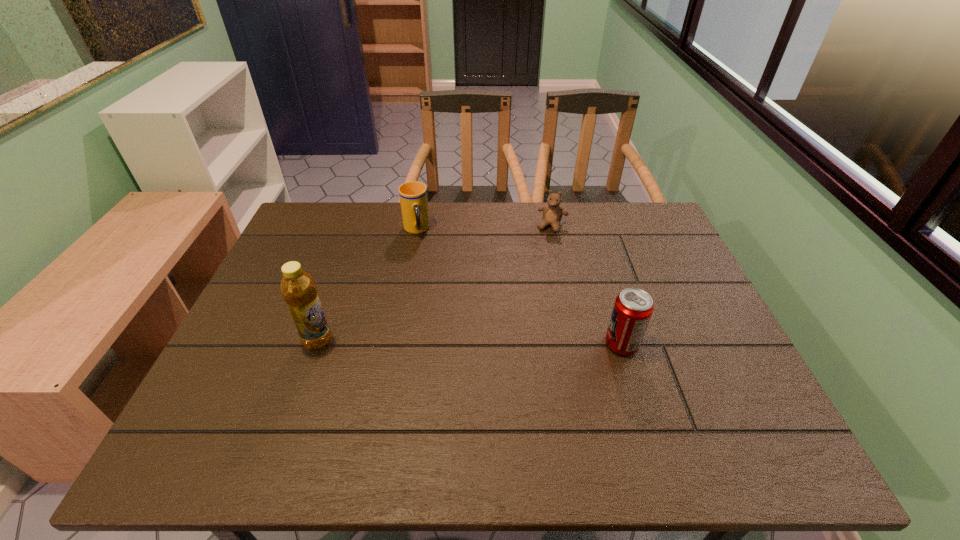
Where is `blank space located 0.380m on the side of the third object from right to left with the handle`? blank space located 0.380m on the side of the third object from right to left with the handle is located at coordinates (442, 331).

Image resolution: width=960 pixels, height=540 pixels. What are the coordinates of `vacant space located 0.340m on the front-facing side of the shortest object` in the screenshot? It's located at (524, 307).

Where is `free location located 0.080m on the front-facing side of the shortest object`? The height and width of the screenshot is (540, 960). free location located 0.080m on the front-facing side of the shortest object is located at coordinates (544, 248).

What are the coordinates of `free space located on the front-facing side of the shortest object` in the screenshot? It's located at pyautogui.click(x=540, y=259).

I want to click on cup located in the far edge section of the desktop, so click(x=413, y=195).

What are the coordinates of `teddy bear that is at the far edge` in the screenshot? It's located at (552, 213).

Identify the location of free region at the far edge of the desktop. (461, 212).

Identify the location of free space at the near edge of the desktop. This screenshot has height=540, width=960. (628, 390).

Where is `blank space at the left edge`? This screenshot has width=960, height=540. blank space at the left edge is located at coordinates (306, 254).

Locate an element on the screen. The height and width of the screenshot is (540, 960). vacant space at the right edge is located at coordinates (668, 353).